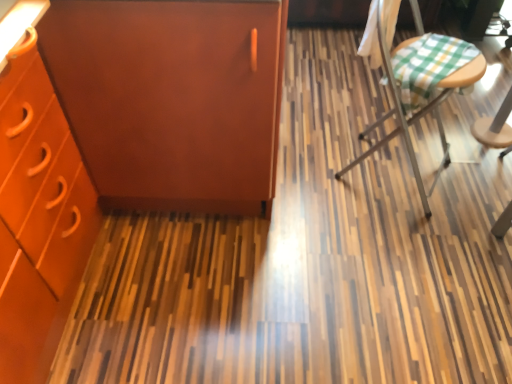
Question: Is green checkered fabric at right bigger or smaller than matte orange cabinet at upper left?

Choices:
 (A) big
 (B) small

Answer: (B)

Question: In terms of height, does green checkered fabric at right look taller or shorter compared to matte orange cabinet at upper left?

Choices:
 (A) tall
 (B) short

Answer: (B)

Question: Which object is positioned farthest from the green checkered fabric at right?

Choices:
 (A) matte orange cabinet at upper left
 (B) matte brown cabinet at left

Answer: (A)

Question: Which object is positioned farthest from the matte brown cabinet at left?

Choices:
 (A) matte orange cabinet at upper left
 (B) green checkered fabric at right

Answer: (B)